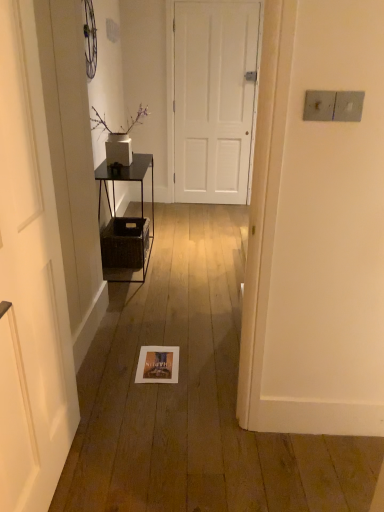
Question: Considering the relative positions of woven brown crate at left and white matte door at left, positioned as the 2th door in right-to-left order, in the image provided, is woven brown crate at left to the left of white matte door at left, positioned as the 2th door in right-to-left order, from the viewer's perspective?

Choices:
 (A) no
 (B) yes

Answer: (B)

Question: From a real-world perspective, is woven brown crate at left beneath white matte door at left, which appears as the first door when viewed from the left?

Choices:
 (A) no
 (B) yes

Answer: (B)

Question: Does woven brown crate at left have a lesser width compared to white matte door at left, the second door from the top?

Choices:
 (A) no
 (B) yes

Answer: (A)

Question: Is woven brown crate at left positioned in front of white matte door at left, positioned as the 2th door in right-to-left order?

Choices:
 (A) yes
 (B) no

Answer: (B)

Question: Can you confirm if woven brown crate at left is wider than white matte door at left, the second door from the top?

Choices:
 (A) no
 (B) yes

Answer: (B)

Question: Which is correct: white matte door at center, which appears as the first door when viewed from the right, is inside black metal shelf at left, or outside of it?

Choices:
 (A) outside
 (B) inside

Answer: (A)

Question: Is white matte door at center, the 1th door positioned from the back, to the left or to the right of black metal shelf at left in the image?

Choices:
 (A) right
 (B) left

Answer: (A)

Question: Does point (205, 89) appear closer or farther from the camera than point (114, 211)?

Choices:
 (A) closer
 (B) farther

Answer: (B)

Question: From the image's perspective, is white matte door at center, the 1th door positioned from the back, above or below black metal shelf at left?

Choices:
 (A) below
 (B) above

Answer: (B)

Question: From the image's perspective, is white matte door at left, positioned as the 2th door in right-to-left order, above or below woven brown crate at left?

Choices:
 (A) above
 (B) below

Answer: (B)

Question: From a real-world perspective, is white matte door at left, which is the 1th door from front to back, physically located above or below woven brown crate at left?

Choices:
 (A) below
 (B) above

Answer: (B)

Question: Relative to woven brown crate at left, is white matte door at left, the 1th door ordered from the bottom, in front or behind?

Choices:
 (A) front
 (B) behind

Answer: (A)

Question: Do you think white matte door at left, the 1th door ordered from the bottom, is within woven brown crate at left, or outside of it?

Choices:
 (A) outside
 (B) inside

Answer: (A)

Question: Does point click(140, 153) appear closer or farther from the camera than point click(3, 167)?

Choices:
 (A) closer
 (B) farther

Answer: (B)

Question: Considering the positions of black metal shelf at left and white matte door at left, which appears as the second door when viewed from the back, in the image, is black metal shelf at left wider or thinner than white matte door at left, which appears as the second door when viewed from the back,?

Choices:
 (A) wide
 (B) thin

Answer: (A)